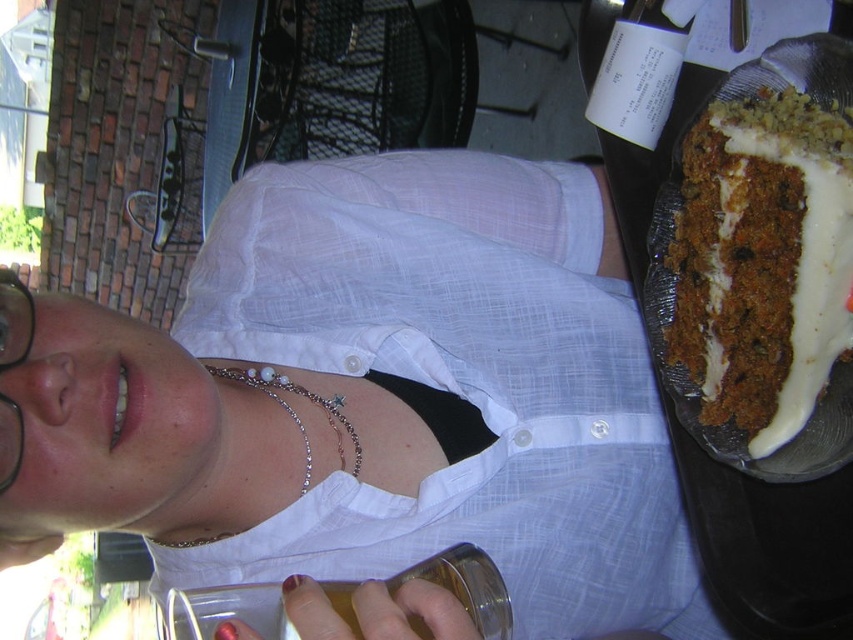
Question: Considering the relative positions of white matte shirt at upper center and black plastic glasses at upper left in the image provided, where is white matte shirt at upper center located with respect to black plastic glasses at upper left?

Choices:
 (A) right
 (B) left

Answer: (A)

Question: Is white matte shirt at upper center wider than black plastic glasses at upper left?

Choices:
 (A) yes
 (B) no

Answer: (A)

Question: Based on their relative distances, which object is farther from the white matte shirt at upper center?

Choices:
 (A) black plastic glasses at upper left
 (B) carrot cake with cream cheese frosting at right

Answer: (A)

Question: Which point is farther to the camera?

Choices:
 (A) carrot cake with cream cheese frosting at right
 (B) black plastic glasses at upper left

Answer: (A)

Question: Considering the real-world distances, which object is closest to the white matte shirt at upper center?

Choices:
 (A) carrot cake with cream cheese frosting at right
 (B) black plastic glasses at upper left

Answer: (A)

Question: Can you confirm if carrot cake with cream cheese frosting at right is positioned to the left of black plastic glasses at upper left?

Choices:
 (A) yes
 (B) no

Answer: (B)